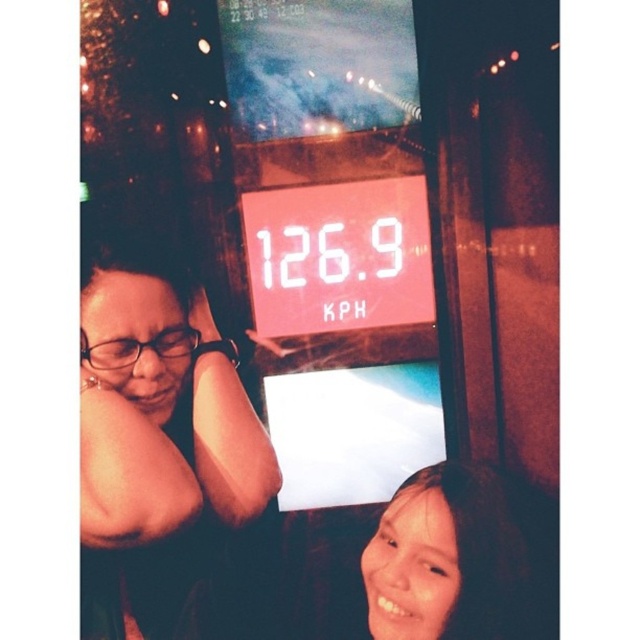
You are inside a moving vehicle and want to know which of the two points, point (269, 284) or point (502, 596), is closer to the back of the vehicle. Based on the scene description, can you determine which point is located closer to the rear?

Point (269, 284) is behind point (502, 596), so it is closer to the back of the vehicle.

You are a passenger on a moving vehicle and want to take a photo of the matte black glasses at left using your phone camera. Considering the distance between you and the glasses, will you be able to capture the entire object in the frame without zooming?

The distance between you and the matte black glasses at left is 3.77 feet. Since this distance is within a typical phone camera lens range, you should be able to capture the entire matte black glasses at left in the frame without needing to zoom.

You are a passenger on the vehicle and want to check the current speed. Where should you look to see the white digital display at center?

The white digital display at center is located at the 2D coordinates point (339, 256), so you should look there to see the current speed.